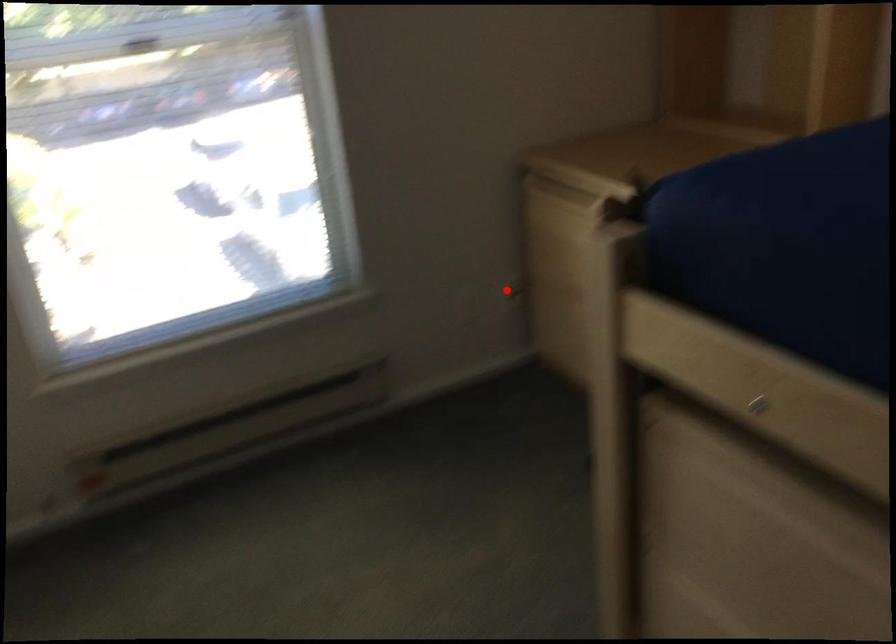
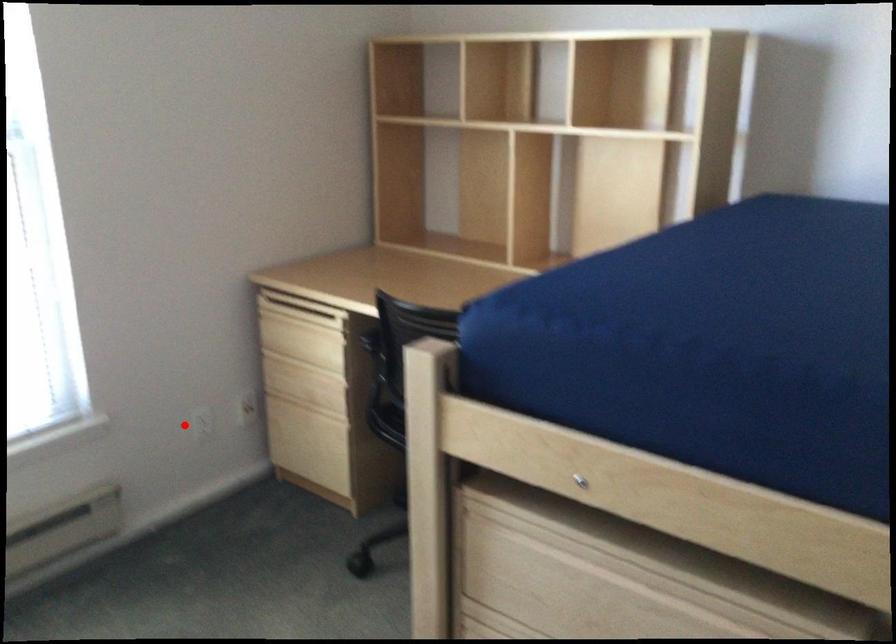
I am providing you with two images of the same scene from different viewpoints. A red point is marked on the first image and another point is marked on the second image. Does the point marked in image1 correspond to the same location as the one in image2?

No